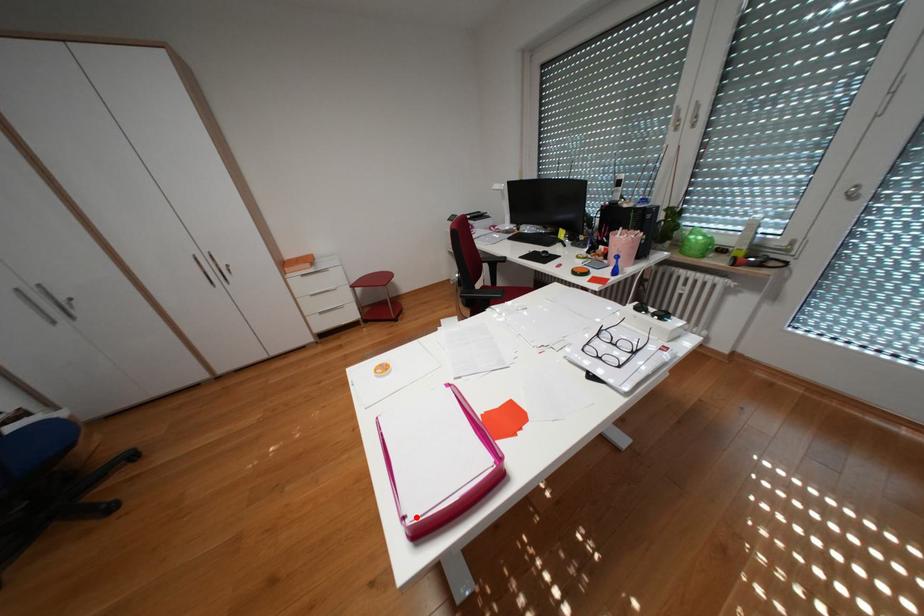
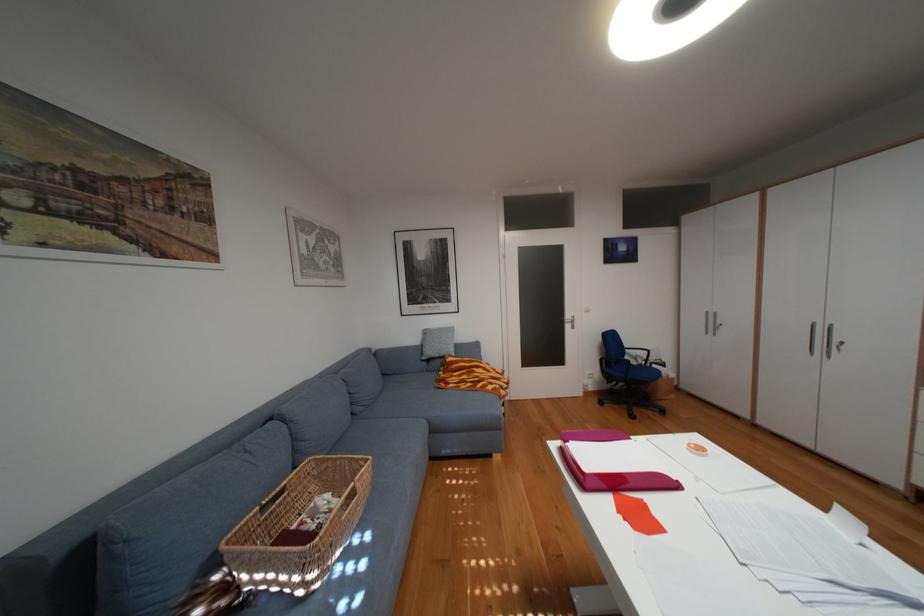
Question: I am providing you with two images of the same scene from different viewpoints. In image1, a red point is highlighted. Considering the same 3D point in image2, which of the following is correct?

Choices:
 (A) It is closer
 (B) It is farther

Answer: (A)